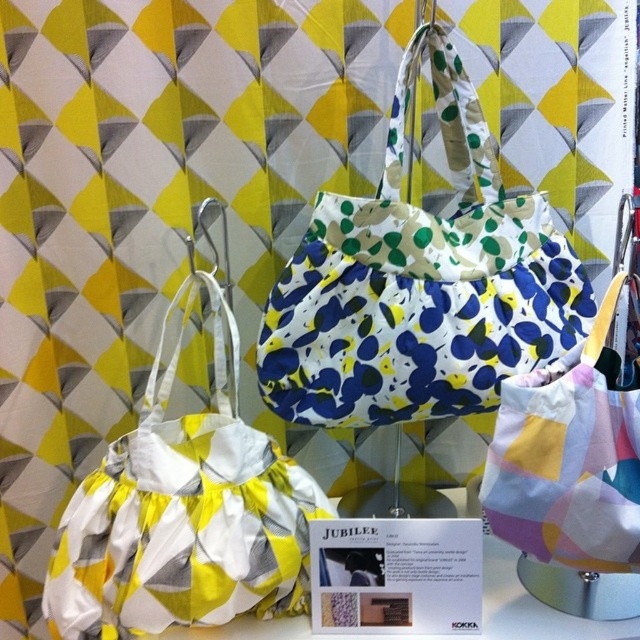
Can you confirm if printed fabric tote bag at center is positioned to the left of white satin bag at left?

No, printed fabric tote bag at center is not to the left of white satin bag at left.

Between printed fabric tote bag at center and white satin bag at left, which one has more height?

With more height is printed fabric tote bag at center.

The height and width of the screenshot is (640, 640). What do you see at coordinates (420, 284) in the screenshot?
I see `printed fabric tote bag at center` at bounding box center [420, 284].

The height and width of the screenshot is (640, 640). What are the coordinates of `printed fabric tote bag at center` in the screenshot? It's located at (420, 284).

Who is higher up, printed fabric tote bag at center or yellow and white fabric bag at center?

printed fabric tote bag at center is higher up.

The width and height of the screenshot is (640, 640). Identify the location of printed fabric tote bag at center. coord(420,284).

Identify the location of printed fabric tote bag at center. [x=420, y=284].

Is white satin bag at left closer to the viewer compared to yellow and white fabric bag at center?

No, white satin bag at left is behind yellow and white fabric bag at center.

Which is below, white satin bag at left or yellow and white fabric bag at center?

Positioned lower is white satin bag at left.

Is point (275, 586) closer to camera compared to point (508, 465)?

No, (275, 586) is further to viewer.

This screenshot has height=640, width=640. I want to click on white satin bag at left, so click(182, 513).